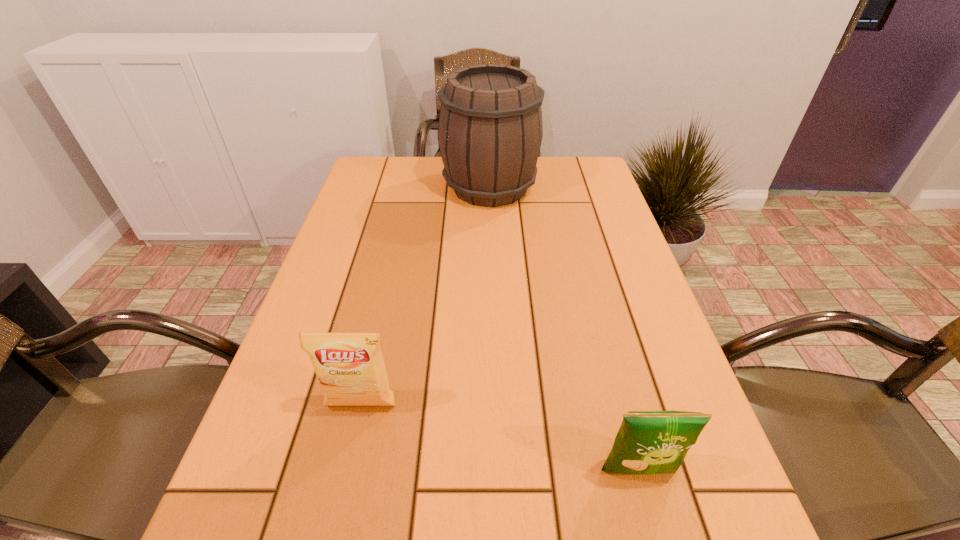
Identify the location of the tallest object. (490, 130).

This screenshot has width=960, height=540. I want to click on wine bucket, so click(x=490, y=130).

The height and width of the screenshot is (540, 960). What are the coordinates of `the leftmost object` in the screenshot? It's located at (350, 368).

Find the location of a particular element. the farther crisp (potato chip) is located at coordinates (350, 368).

Locate an element on the screen. The height and width of the screenshot is (540, 960). the shorter crisp (potato chip) is located at coordinates (648, 442).

Identify the location of the rightmost object. This screenshot has width=960, height=540. (648, 442).

Where is `free location located 0.160m on the front of the farthest object`? free location located 0.160m on the front of the farthest object is located at coordinates (492, 249).

The width and height of the screenshot is (960, 540). In order to click on vacant space located 0.120m on the front of the left crisp (potato chip) with the logo in this screenshot , I will do `click(344, 485)`.

Find the location of a particular element. This screenshot has height=540, width=960. object at the far edge is located at coordinates (490, 130).

Find the location of a particular element. Image resolution: width=960 pixels, height=540 pixels. object at the left edge is located at coordinates (350, 368).